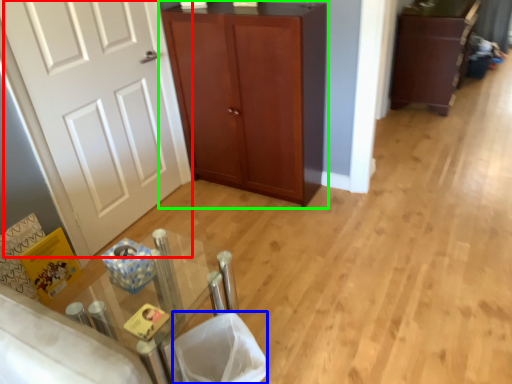
Question: Which object is positioned closest to door (highlighted by a red box)? Select from laundry basket (highlighted by a blue box) and cupboard (highlighted by a green box).

Choices:
 (A) laundry basket
 (B) cupboard

Answer: (B)